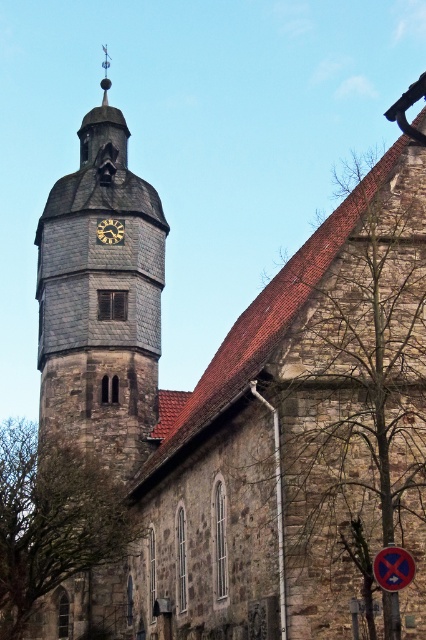
Is the position of stone clock tower at center less distant than that of metallic reflective sign at center?

No, it is behind metallic reflective sign at center.

Between point (63, 176) and point (382, 586), which one is positioned behind?

The point (63, 176) is more distant.

Is point (100, 321) positioned before point (405, 557)?

No, (100, 321) is further to viewer.

The image size is (426, 640). What are the coordinates of `stone clock tower at center` in the screenshot? It's located at (100, 301).

Which is above, metallic reflective sign at center or matte gray clock at center?

Positioned higher is matte gray clock at center.

Does metallic reflective sign at center have a larger size compared to matte gray clock at center?

Incorrect, metallic reflective sign at center is not larger than matte gray clock at center.

Between point (388, 570) and point (117, 220), which one is positioned in front?

Point (388, 570)

In order to click on metallic reflective sign at center in this screenshot , I will do `click(393, 566)`.

Is matte gray clock at center positioned in front of shiny metal spire at upper center?

Yes, it is in front of shiny metal spire at upper center.

Is matte gray clock at center to the right of shiny metal spire at upper center from the viewer's perspective?

Indeed, matte gray clock at center is positioned on the right side of shiny metal spire at upper center.

This screenshot has width=426, height=640. In order to click on matte gray clock at center in this screenshot , I will do [x=109, y=230].